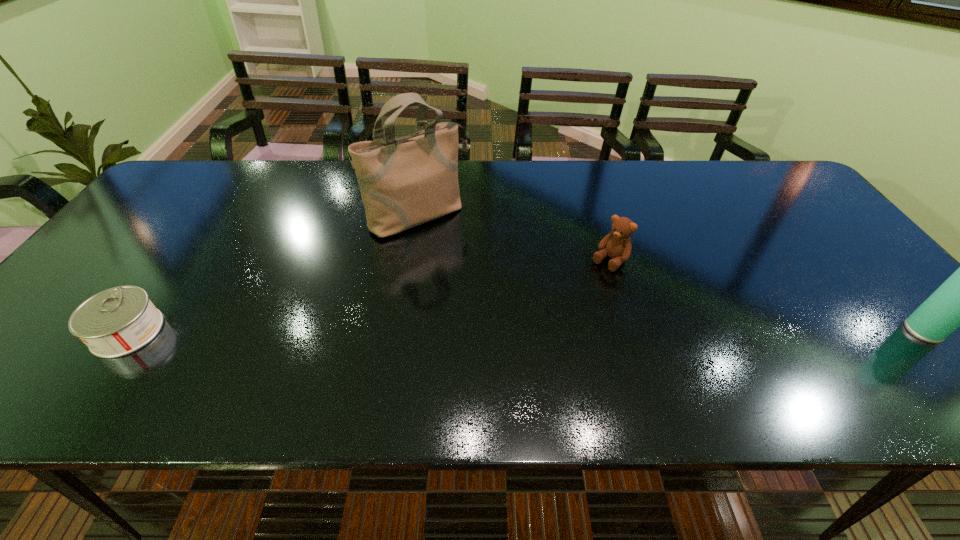
Where is `object positioned at the right edge`? object positioned at the right edge is located at coordinates (959, 302).

Image resolution: width=960 pixels, height=540 pixels. Find the location of `object positioned at the near left corner`. object positioned at the near left corner is located at coordinates (118, 321).

I want to click on object at the near right corner, so click(x=959, y=302).

Locate an element on the screen. The image size is (960, 540). vacant space at the far edge of the desktop is located at coordinates (551, 176).

You are a GUI agent. You are given a task and a screenshot of the screen. Output one action in this format:
    pyautogui.click(x=<x>, y=<y>)
    Task: Click on the free region at the near edge of the desktop
    This screenshot has width=960, height=540.
    Given the screenshot: What is the action you would take?
    pyautogui.click(x=270, y=360)

You are a GUI agent. You are given a task and a screenshot of the screen. Output one action in this format:
    pyautogui.click(x=<x>, y=<y>)
    Task: Click on the vacant area at the left edge of the desktop
    Image resolution: width=960 pixels, height=540 pixels.
    Given the screenshot: What is the action you would take?
    pyautogui.click(x=188, y=217)

Image resolution: width=960 pixels, height=540 pixels. In the image, there is a desktop. Identify the location of free space at the right edge. click(x=875, y=297).

This screenshot has width=960, height=540. Find the location of `vacant space at the far left corner of the desktop`. vacant space at the far left corner of the desktop is located at coordinates (179, 179).

Locate an element on the screen. free spot at the near right corner of the desktop is located at coordinates (877, 355).

Where is `blank region between the thermos bottle and the shortest object`? This screenshot has height=540, width=960. blank region between the thermos bottle and the shortest object is located at coordinates (525, 331).